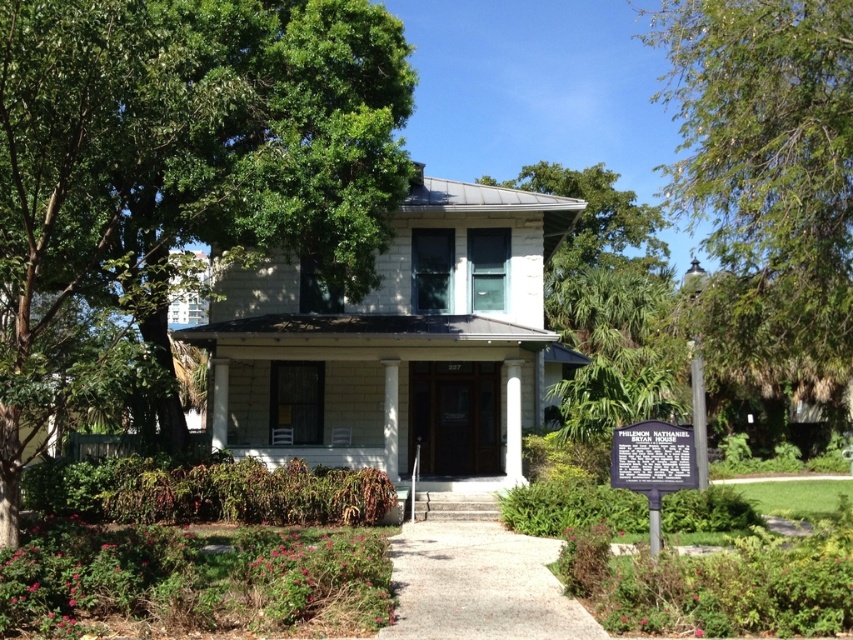
You are a painter planning to paint the house. You need to know which object, the green leafy tree at upper center or the black metal sign at lower center, is wider to decide where to place your ladder. Which one is wider?

The green leafy tree at upper center is wider than the black metal sign at lower center.

You are standing in front of the house and want to walk towards the green leafy tree at right and the green leafy tree at upper center. Which tree will you reach first?

The green leafy tree at right is closer to the viewer than the green leafy tree at upper center, so you will reach the green leafy tree at right first.